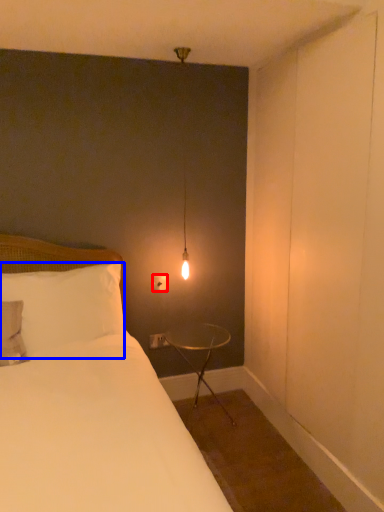
Question: Among these objects, which one is nearest to the camera, electric outlet (highlighted by a red box) or pillow (highlighted by a blue box)?

Choices:
 (A) electric outlet
 (B) pillow

Answer: (B)